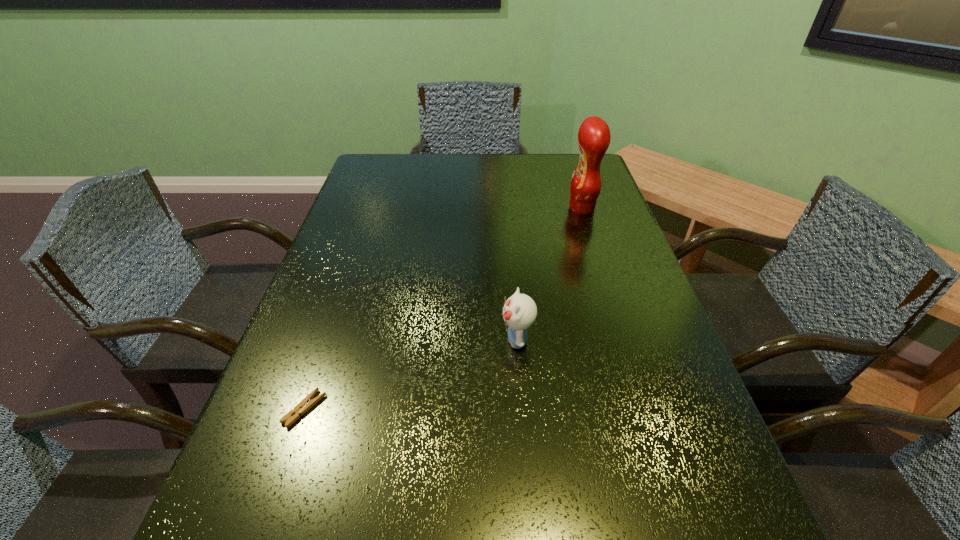
Identify the location of vacant point located 0.250m on the front-facing side of the second object from left to right. (377, 339).

This screenshot has height=540, width=960. In order to click on free region located 0.070m on the front-facing side of the second object from left to right in this screenshot , I will do `click(466, 339)`.

You are a GUI agent. You are given a task and a screenshot of the screen. Output one action in this format:
    pyautogui.click(x=<x>, y=<y>)
    Task: Click on the vacant area situated 0.370m on the right of the shortest object
    
    Given the screenshot: What is the action you would take?
    pyautogui.click(x=531, y=409)

At what (x,y) coordinates should I click in order to perform the action: click on object that is positioned at the left edge. Please return your answer as a coordinate pair (x, y). Looking at the image, I should click on (292, 416).

Locate an element on the screen. object located in the right edge section of the desktop is located at coordinates (594, 137).

In the image, there is a desktop. In order to click on vacant area at the far edge in this screenshot , I will do `click(436, 169)`.

Identify the location of vacant space at the left edge. (277, 388).

Image resolution: width=960 pixels, height=540 pixels. Find the location of `vacant space at the right edge`. vacant space at the right edge is located at coordinates (668, 376).

Where is `vacant space at the far left corner of the desktop`? The width and height of the screenshot is (960, 540). vacant space at the far left corner of the desktop is located at coordinates (384, 161).

The image size is (960, 540). What are the coordinates of `empty space that is in between the farthest object and the nearest object` in the screenshot? It's located at pyautogui.click(x=444, y=308).